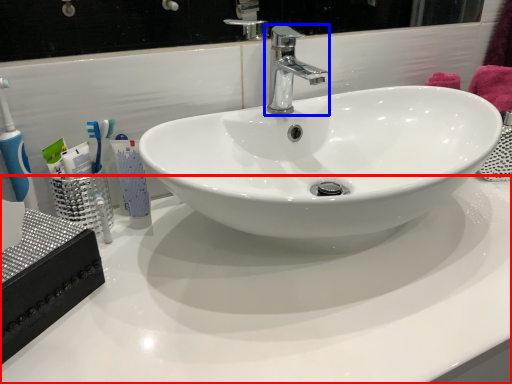
Question: Which object is closer to the camera taking this photo, counter top (highlighted by a red box) or tap (highlighted by a blue box)?

Choices:
 (A) counter top
 (B) tap

Answer: (A)